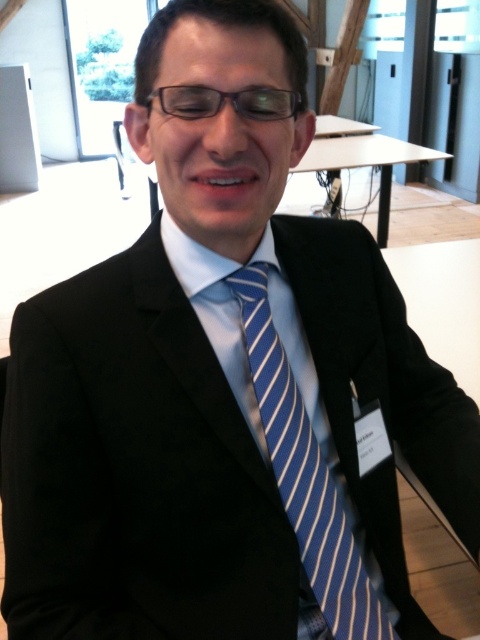
You need to place a book that requires a flat surface on the white matte table at upper center or the transparent plastic glasses at center. Which object can you place the book on?

You can place the book on the white matte table at upper center because it has a greater height compared to the transparent plastic glasses at center, making it suitable for placing objects.

You are a photographer adjusting your camera settings to capture a closeup of the blue striped tie at center. The camera is currently positioned 24.74 inches away from the tie. If you want to ensure the entire tie is in focus, should you move the camera closer or farther away?

The camera is already positioned 24.74 inches away from the blue striped tie at center. To ensure the entire tie is in focus, you should move the camera farther away to increase the depth of field.

You are a photographer setting up for a professional headshot. You need to ensure that the blue striped tie at center and the transparent plastic glasses at center are both clearly visible in the shot. Based on their positions, which one should you focus on first to ensure proper framing?

The transparent plastic glasses at center should be focused on first because the blue striped tie at center is located below them, meaning the glasses are higher up and closer to the main focal point of the face.